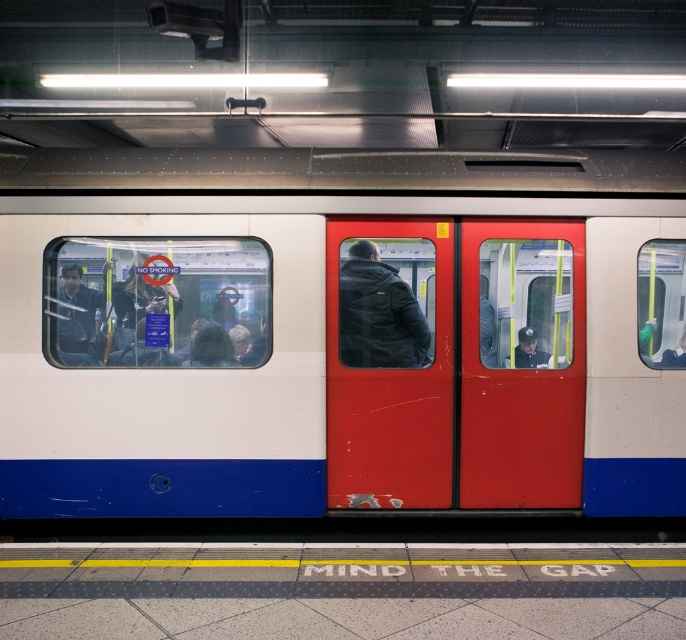
You are standing on the platform at the London Underground station and notice the smooth red door at center. If you want to board the train, which direction should you move relative to the door to reach the nearest entrance?

The smooth red door at center is located at point coordinates, so you should move towards the center of the platform to reach the nearest entrance.

You are standing on the platform of the London Underground station. You see a point marked at coordinates (335,337). What object does this point correspond to?

The point at coordinates (335,337) corresponds to the white glossy train at center.

You are a passenger on the platform and want to board the train. There is a dark blue leather jacket at center and a dark blue uniform at center blocking your path. Can you walk between them without touching either?

The dark blue leather jacket at center is 35.06 inches away from dark blue uniform at center. Since 35.06 inches is approximately 2.92 feet, which is more than enough space for a person to walk through without touching either object.